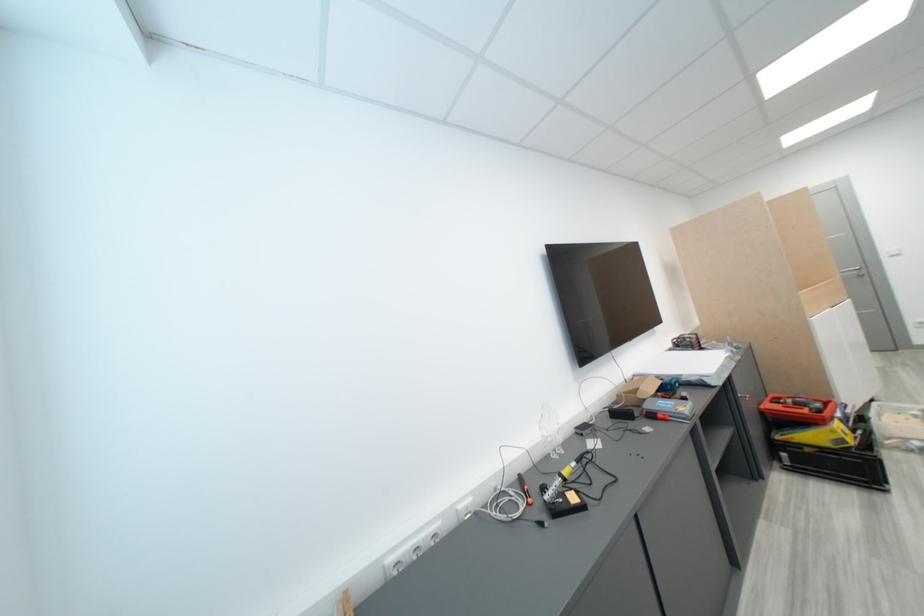
The height and width of the screenshot is (616, 924). In order to click on blue tool case latch in this screenshot , I will do `click(669, 387)`.